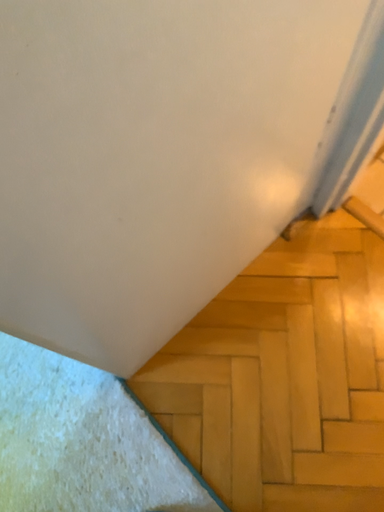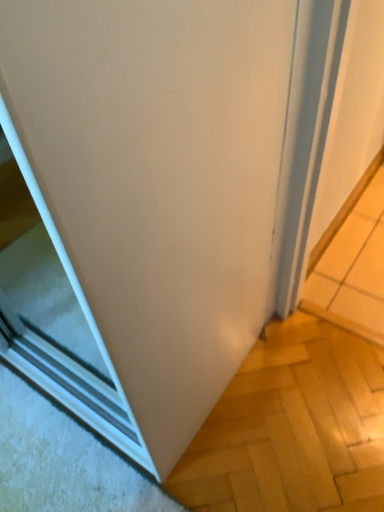
Question: How did the camera likely rotate when shooting the video?

Choices:
 (A) rotated downward
 (B) rotated upward

Answer: (B)